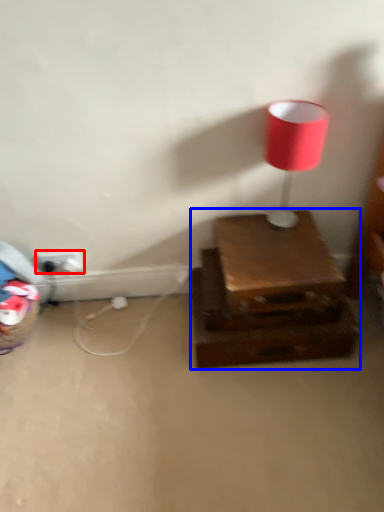
Question: Which object is further to the camera taking this photo, electric outlet (highlighted by a red box) or furniture (highlighted by a blue box)?

Choices:
 (A) electric outlet
 (B) furniture

Answer: (A)